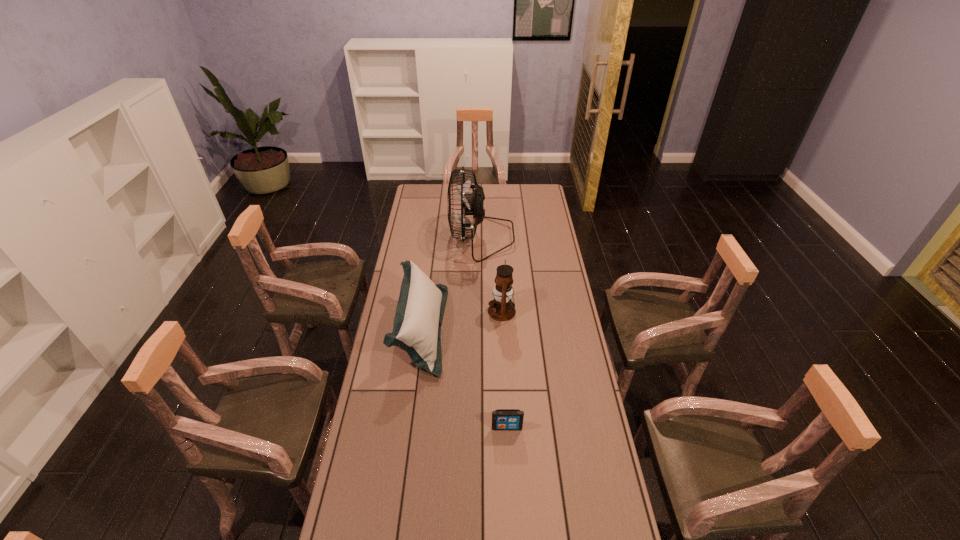
Locate an element on the screen. The width and height of the screenshot is (960, 540). vacant point located between the tallest object and the third tallest object is located at coordinates (451, 284).

Identify the location of free space between the lantern and the second shortest object. Image resolution: width=960 pixels, height=540 pixels. (462, 320).

This screenshot has height=540, width=960. What are the coordinates of `free space that is in between the cushion and the nearest object` in the screenshot? It's located at (464, 379).

Locate an element on the screen. This screenshot has width=960, height=540. vacant space that is in between the fan and the third tallest object is located at coordinates click(451, 284).

The height and width of the screenshot is (540, 960). What are the coordinates of `vacant area that lies between the second shortest object and the second tallest object` in the screenshot? It's located at (462, 320).

Locate an element on the screen. The width and height of the screenshot is (960, 540). vacant area that lies between the fan and the nearest object is located at coordinates (494, 333).

Choose which object is the third nearest neighbor to the cushion. Please provide its 2D coordinates. Your answer should be formatted as a tuple, i.e. [(x, y)], where the tuple contains the x and y coordinates of a point satisfying the conditions above.

[(502, 419)]

I want to click on object that stands as the third closest to the cushion, so click(502, 419).